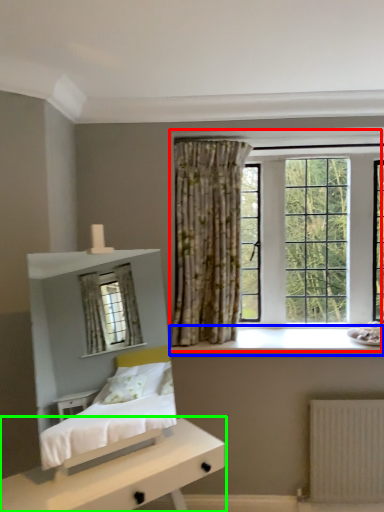
Question: Which is nearer to the window (highlighted by a red box)? window sill (highlighted by a blue box) or nightstand (highlighted by a green box).

Choices:
 (A) window sill
 (B) nightstand

Answer: (A)